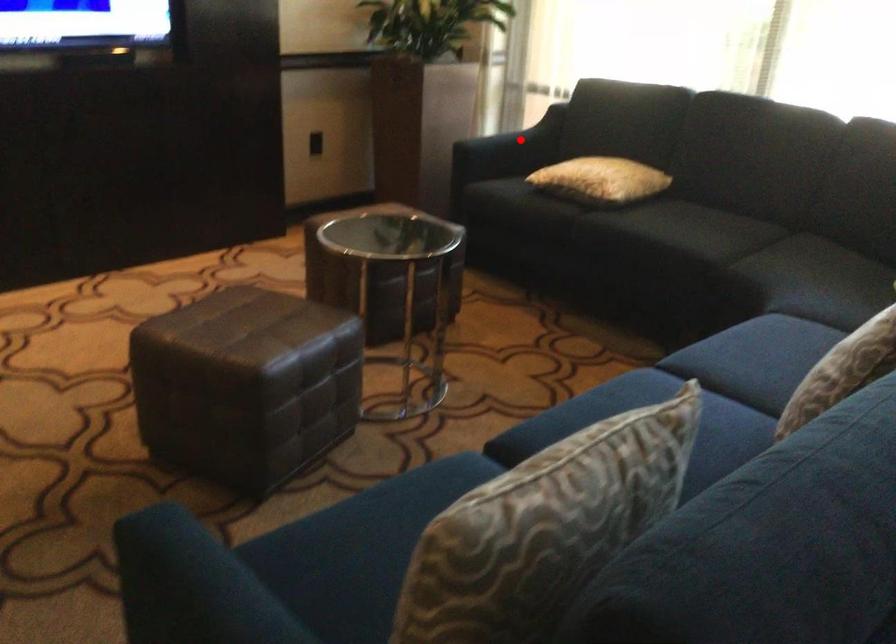
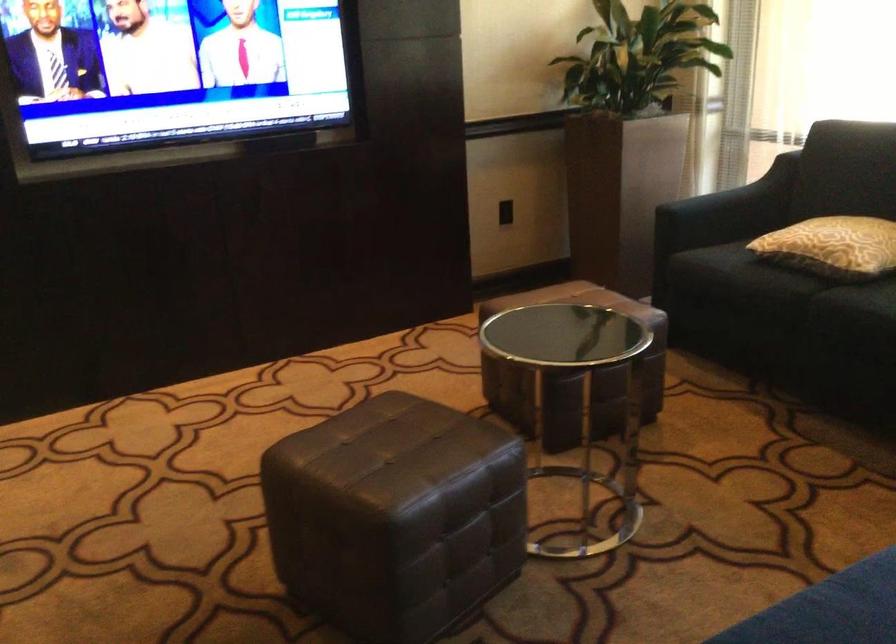
Locate, in the second image, the point that corresponds to the highlighted location in the first image.

(742, 196)